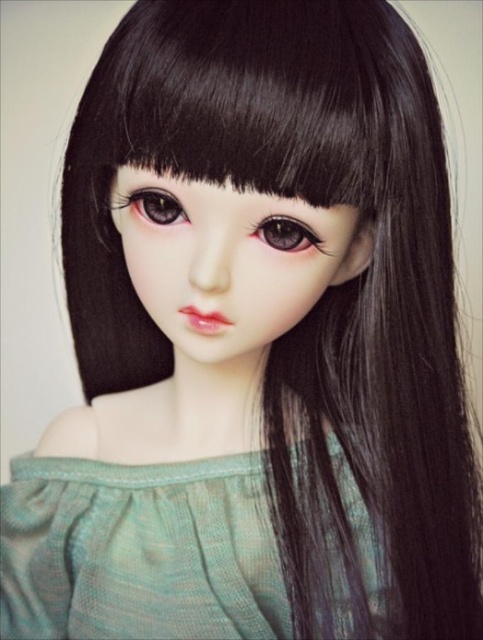
Is point (269, 189) farther from camera compared to point (173, 200)?

No, (269, 189) is in front of (173, 200).

Who is higher up, black silky hair at upper center or brown glossy eye at center?

black silky hair at upper center

Which is in front, point (318, 189) or point (170, 214)?

Point (318, 189) is in front.

Locate an element on the screen. The height and width of the screenshot is (640, 483). black silky hair at upper center is located at coordinates (254, 172).

Who is positioned more to the right, green knitted dress at center or satin brown eye at center?

Positioned to the right is satin brown eye at center.

Describe the element at coordinates (140, 550) in the screenshot. I see `green knitted dress at center` at that location.

Locate an element on the screen. This screenshot has height=640, width=483. green knitted dress at center is located at coordinates (140, 550).

Measure the distance between green knitted dress at center and brown glossy eye at center.

They are 35.85 centimeters apart.

Between point (339, 636) and point (175, 218), which one is positioned behind?

Point (339, 636)

Where is `green knitted dress at center`? This screenshot has height=640, width=483. green knitted dress at center is located at coordinates (140, 550).